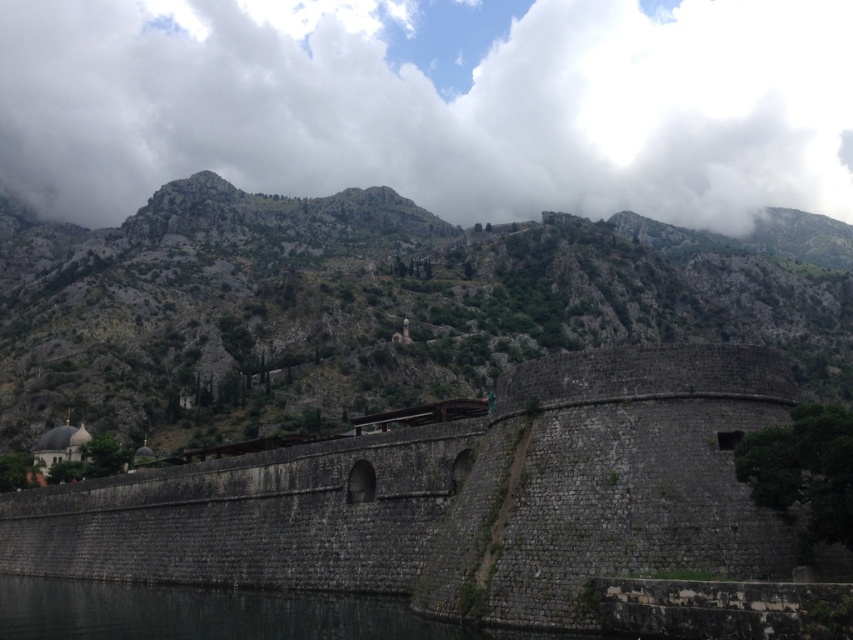
Who is positioned more to the left, dark stone wall at center or dark gray water at lower left?

dark gray water at lower left is more to the left.

Between dark stone wall at center and dark gray water at lower left, which one has less height?

dark gray water at lower left

Is point (602, 545) more distant than point (402, 636)?

That is False.

This screenshot has width=853, height=640. What are the coordinates of `dark stone wall at center` in the screenshot? It's located at (489, 509).

Is white fluffy cloud at upper center to the left of dark gray water at lower left from the viewer's perspective?

Incorrect, white fluffy cloud at upper center is not on the left side of dark gray water at lower left.

Is point (154, 3) positioned after point (403, 618)?

Yes, it is.

The width and height of the screenshot is (853, 640). I want to click on white fluffy cloud at upper center, so click(433, 106).

Does white fluffy cloud at upper center have a lesser height compared to rugged stone mountain at center?

No.

Is point (256, 154) more distant than point (312, 314)?

That is True.

Find the location of a particular element. white fluffy cloud at upper center is located at coordinates (433, 106).